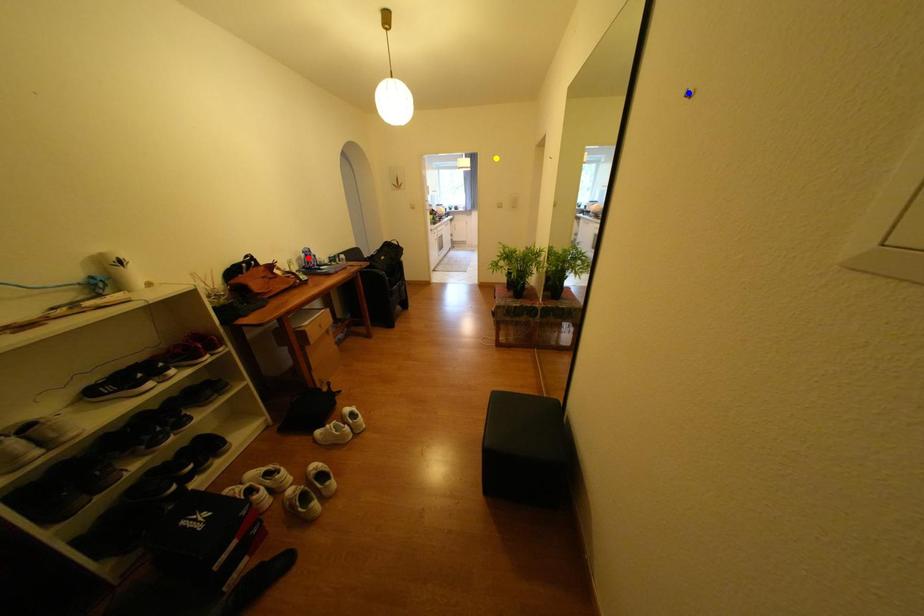
Order these from nearest to farthest:
yellow point
blue point
red point

blue point
red point
yellow point